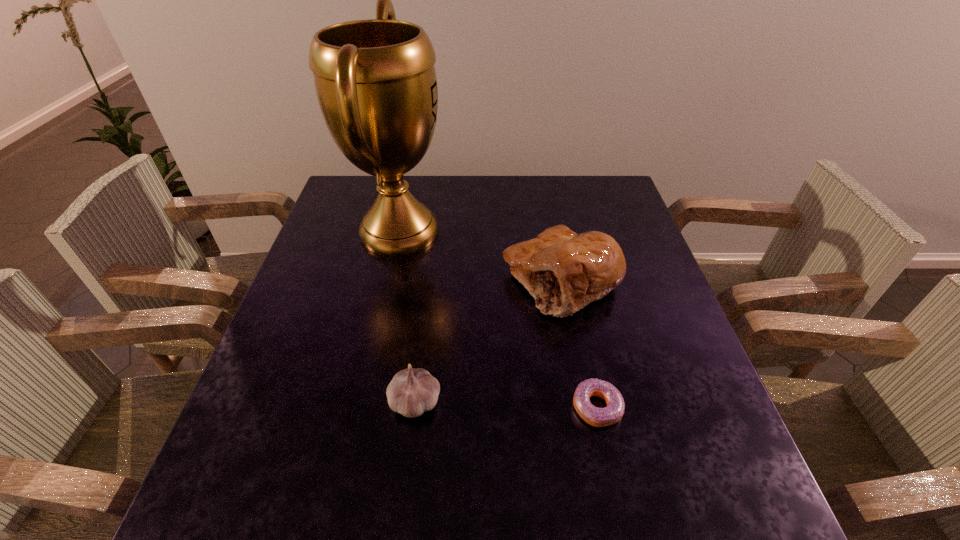
The image size is (960, 540). Find the location of `empty location between the trophy cup and the doughnut`. empty location between the trophy cup and the doughnut is located at coordinates (498, 319).

Identify the location of vacant region between the doughnut and the garlic. The width and height of the screenshot is (960, 540). (506, 405).

Where is `vacant area that lies between the bread and the shortest object`? The height and width of the screenshot is (540, 960). vacant area that lies between the bread and the shortest object is located at coordinates (579, 344).

The height and width of the screenshot is (540, 960). In order to click on blank region between the garlic and the trophy cup in this screenshot , I will do `click(407, 316)`.

This screenshot has height=540, width=960. What are the coordinates of `empty space between the shortest object and the tallest object` in the screenshot? It's located at (498, 319).

The image size is (960, 540). I want to click on vacant area that lies between the shortest object and the bread, so click(579, 344).

At what (x,y) coordinates should I click in order to perform the action: click on empty space between the garlic and the tallest object. Please return your answer as a coordinate pair (x, y). This screenshot has width=960, height=540. Looking at the image, I should click on (407, 316).

The image size is (960, 540). In order to click on free space that is in between the doughnut and the tallest object in this screenshot , I will do `click(498, 319)`.

You are a GUI agent. You are given a task and a screenshot of the screen. Output one action in this format:
    pyautogui.click(x=<x>, y=<y>)
    Task: Click on the unoccupied area between the second shortest object and the trophy cup
    The image size is (960, 540).
    Given the screenshot: What is the action you would take?
    pyautogui.click(x=407, y=316)

Locate an element on the screen. The width and height of the screenshot is (960, 540). object that is the second closest to the tallest object is located at coordinates 411,392.